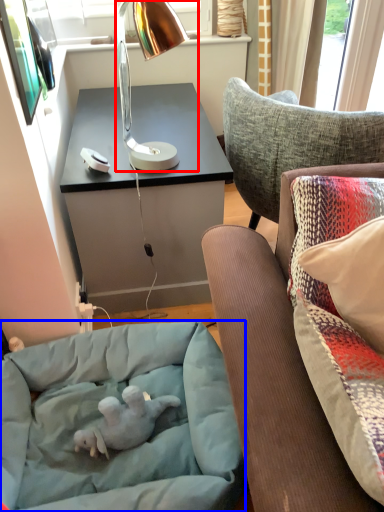
Question: Which object is further to the camera taking this photo, lamp (highlighted by a red box) or dog bed (highlighted by a blue box)?

Choices:
 (A) lamp
 (B) dog bed

Answer: (A)